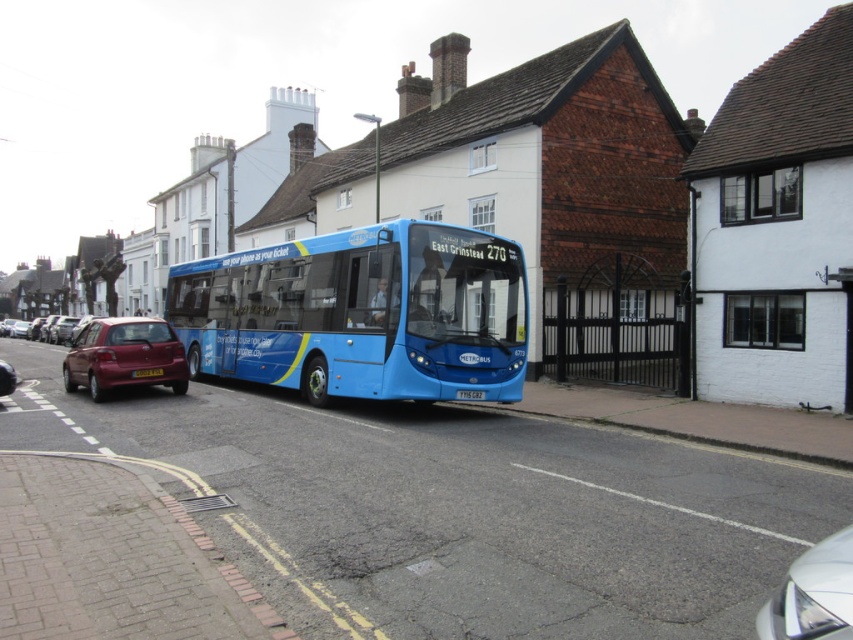
Locate an element on the screen. This screenshot has width=853, height=640. yellow metallic license plate at center is located at coordinates (469, 394).

Is yellow metallic license plate at center shorter than white plastic license plate at center?

Incorrect, yellow metallic license plate at center's height does not fall short of white plastic license plate at center's.

Does point (469, 388) come closer to viewer compared to point (140, 376)?

Yes.

The image size is (853, 640). I want to click on yellow metallic license plate at center, so click(x=469, y=394).

Which of these two, metallic red car at left or yellow metallic license plate at center, stands shorter?

yellow metallic license plate at center is shorter.

Between metallic red car at left and yellow metallic license plate at center, which one appears on the right side from the viewer's perspective?

From the viewer's perspective, yellow metallic license plate at center appears more on the right side.

Is point (15, 387) in front of point (463, 397)?

No, (15, 387) is behind (463, 397).

Where is `metallic red car at left`? The height and width of the screenshot is (640, 853). metallic red car at left is located at coordinates (6, 378).

Who is higher up, black metal gate at center or white plastic license plate at center?

black metal gate at center is higher up.

Is black metal gate at center thinner than white plastic license plate at center?

Yes.

Which is behind, point (669, 346) or point (132, 376)?

The point (669, 346) is more distant.

The width and height of the screenshot is (853, 640). In order to click on black metal gate at center in this screenshot , I will do tap(618, 324).